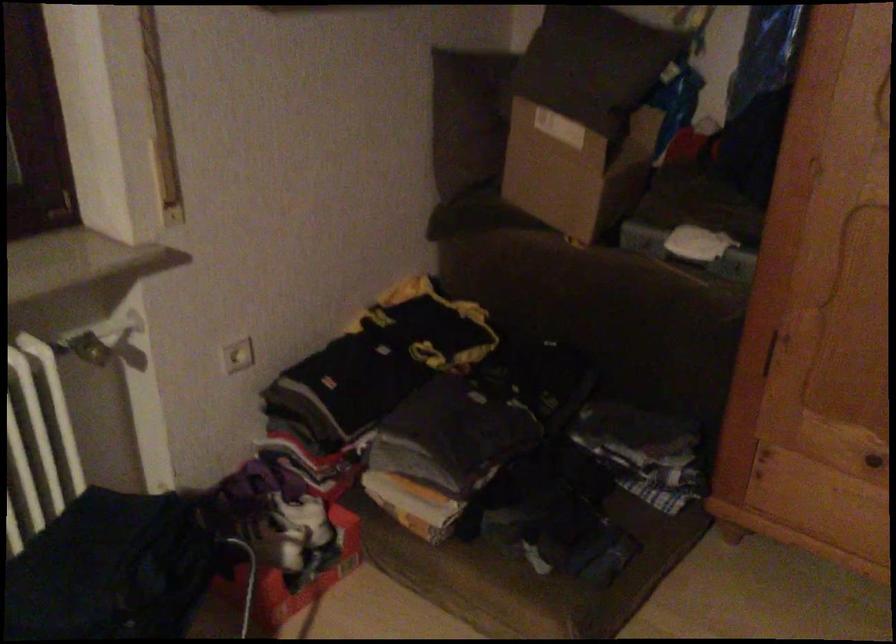
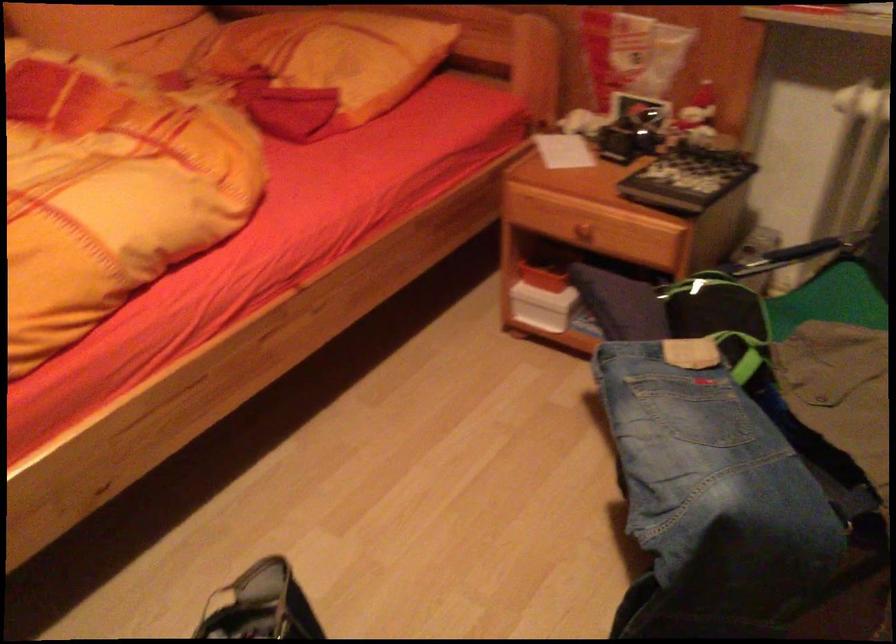
First-person continuous shooting, in which direction is the camera rotating?

The rotation direction of the camera is left-down.